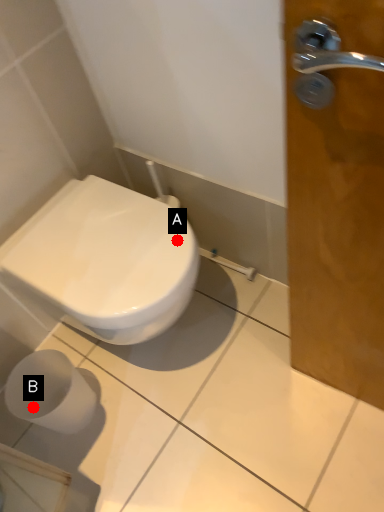
Question: Two points are circled on the image, labeled by A and B beside each circle. Which of the following is the closest to the observer?

Choices:
 (A) A is closer
 (B) B is closer

Answer: (A)